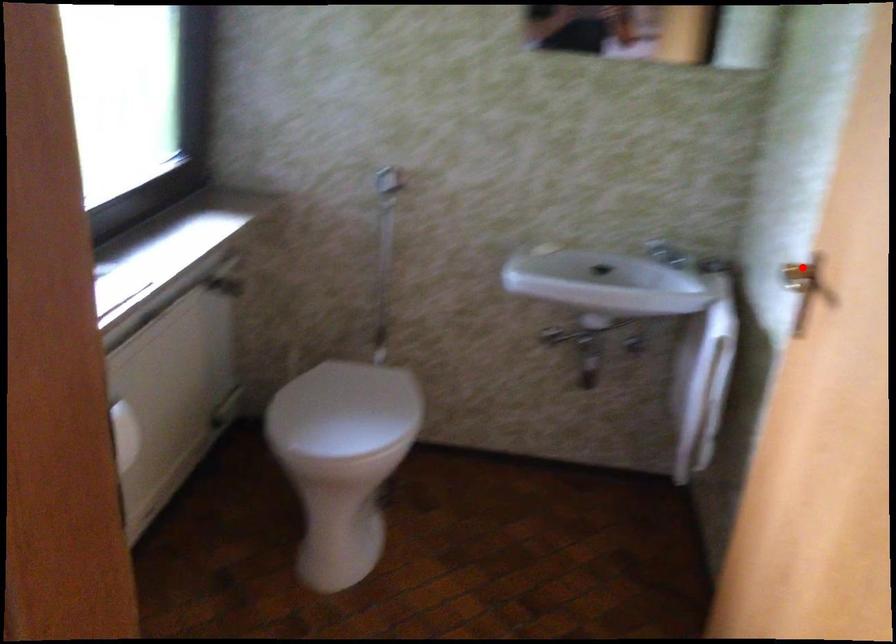
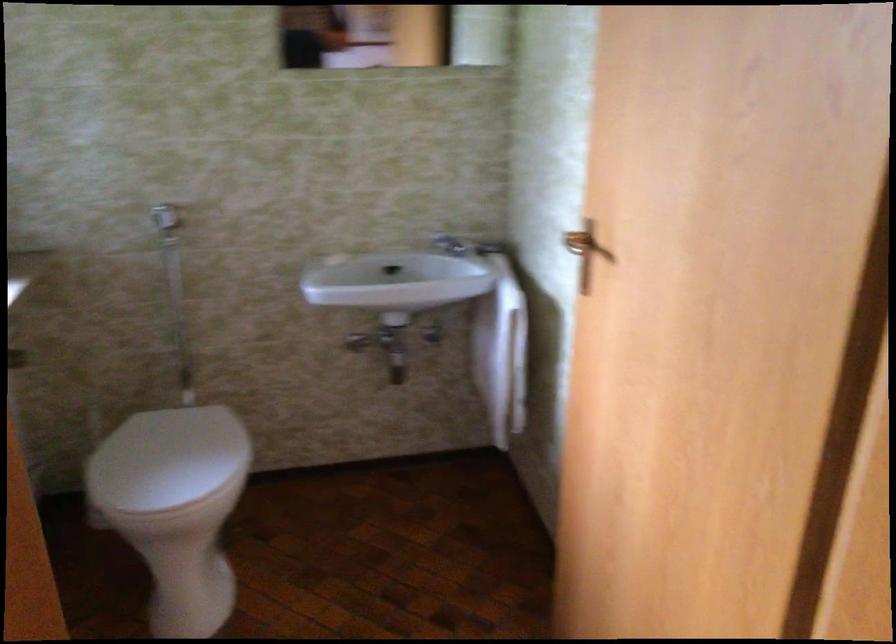
Question: I am providing you with two images of the same scene from different viewpoints. A red point is shown in image1. For the corresponding object point in image2, is it positioned nearer or farther from the camera?

Choices:
 (A) Nearer
 (B) Farther

Answer: (B)